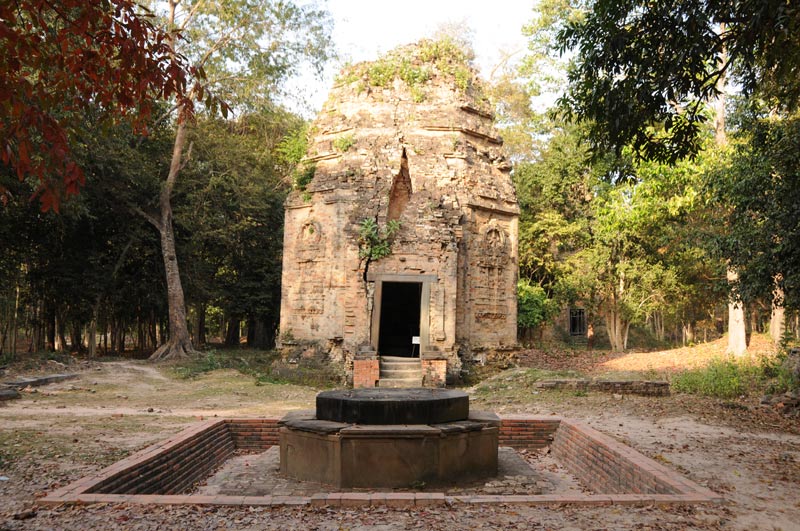
Locate an element on the screen. This screenshot has width=800, height=531. plywood leaning next to stairs is located at coordinates (438, 373), (364, 373).